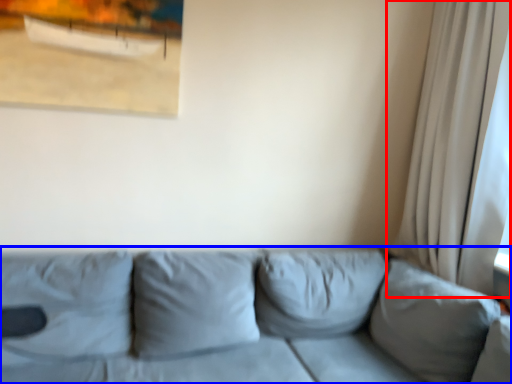
Question: Which of the following is the closest to the observer, curtain (highlighted by a red box) or studio couch (highlighted by a blue box)?

Choices:
 (A) curtain
 (B) studio couch

Answer: (B)